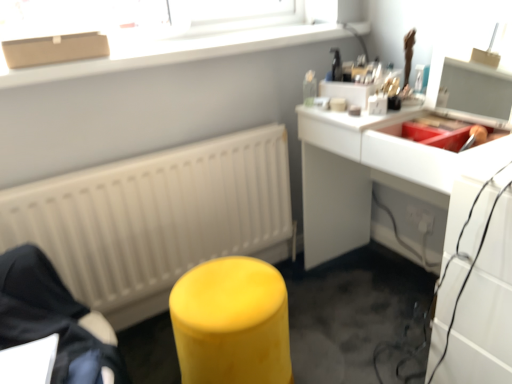
Question: Is the depth of white plastic electric outlet at lower right less than that of matte yellow stool at lower left, which appears as the first furniture when viewed from the left?

Choices:
 (A) no
 (B) yes

Answer: (A)

Question: Is white plastic electric outlet at lower right bigger than matte yellow stool at lower left, which appears as the first furniture when viewed from the left?

Choices:
 (A) yes
 (B) no

Answer: (B)

Question: Can you confirm if white plastic electric outlet at lower right is taller than matte yellow stool at lower left, the 2th furniture from the right?

Choices:
 (A) no
 (B) yes

Answer: (A)

Question: From a real-world perspective, is white plastic electric outlet at lower right under matte yellow stool at lower left, the 2th furniture from the right?

Choices:
 (A) yes
 (B) no

Answer: (A)

Question: Considering the relative sizes of white plastic electric outlet at lower right and matte yellow stool at lower left, the 2th furniture from the right, in the image provided, is white plastic electric outlet at lower right wider than matte yellow stool at lower left, the 2th furniture from the right,?

Choices:
 (A) no
 (B) yes

Answer: (A)

Question: From the image's perspective, is white plastic electric outlet at lower right located above or below white glossy desk at upper right?

Choices:
 (A) below
 (B) above

Answer: (A)

Question: Would you say white plastic electric outlet at lower right is inside or outside white glossy desk at upper right?

Choices:
 (A) outside
 (B) inside

Answer: (B)

Question: From a real-world perspective, is white plastic electric outlet at lower right positioned above or below white glossy desk at upper right?

Choices:
 (A) above
 (B) below

Answer: (B)

Question: Relative to white glossy desk at upper right, is white plastic electric outlet at lower right in front or behind?

Choices:
 (A) front
 (B) behind

Answer: (B)

Question: Is white glossy desk at upper right wider or thinner than white plastic electric outlet at lower right?

Choices:
 (A) wide
 (B) thin

Answer: (A)

Question: From a real-world perspective, is white glossy desk at upper right above or below white plastic electric outlet at lower right?

Choices:
 (A) above
 (B) below

Answer: (A)

Question: Is point (311, 170) closer or farther from the camera than point (419, 221)?

Choices:
 (A) farther
 (B) closer

Answer: (B)

Question: From the image's perspective, relative to white plastic electric outlet at lower right, is white glossy desk at upper right above or below?

Choices:
 (A) below
 (B) above

Answer: (B)

Question: From the image's perspective, is matte white window sill at upper center above or below matte yellow stool at center, the second furniture in the left-to-right sequence?

Choices:
 (A) above
 (B) below

Answer: (A)

Question: Does point (168, 59) appear closer or farther from the camera than point (234, 372)?

Choices:
 (A) farther
 (B) closer

Answer: (A)